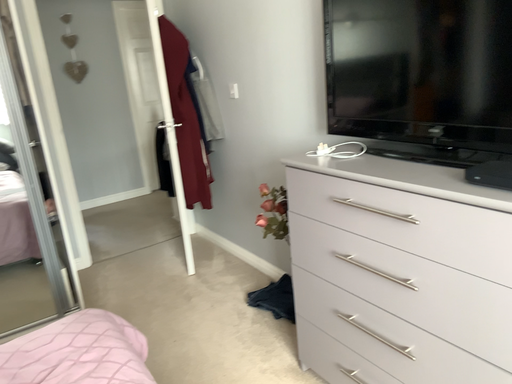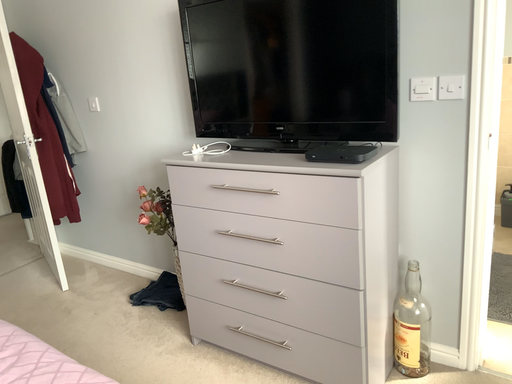
Question: Which way did the camera rotate in the video?

Choices:
 (A) rotated left
 (B) rotated right

Answer: (B)